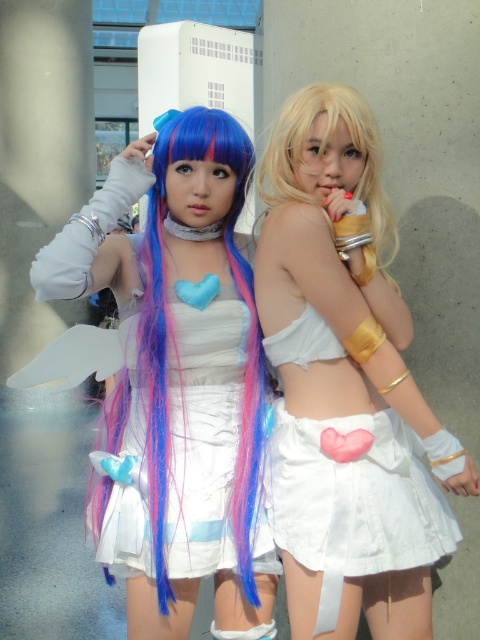
You are organizing a cosplay event and need to ensure that the two performers can walk side by side without their costumes touching. Given the descriptions of the matte white dress at center and the white matte skirt at center, which costume might require more space between them?

The matte white dress at center has a larger width than the white matte skirt at center, so the matte white dress at center would require more space between the performers to avoid touching.

You are standing at the point labeled as point (242,144) in the image. If you want to approach the two cosplayers dressed in white, which direction should you move to get closer to them?

Since the point (242,144) is 8.17 feet away from the viewer, you should move forward towards the direction of the two cosplayers to reduce the distance between you and them.

You are a photographer trying to capture the perfect shot of the two cosplayers. You notice a point marked at coordinates (346, 387) in the image. Based on the scene description, what object is located at this point?

The point at coordinates (346, 387) marks the white matte skirt at center.